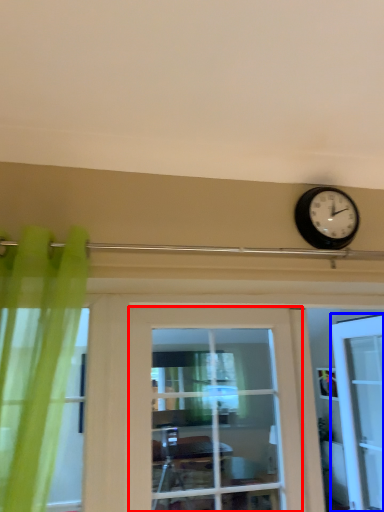
Question: Which of the following is the closest to the observer, door (highlighted by a red box) or door (highlighted by a blue box)?

Choices:
 (A) door
 (B) door

Answer: (A)